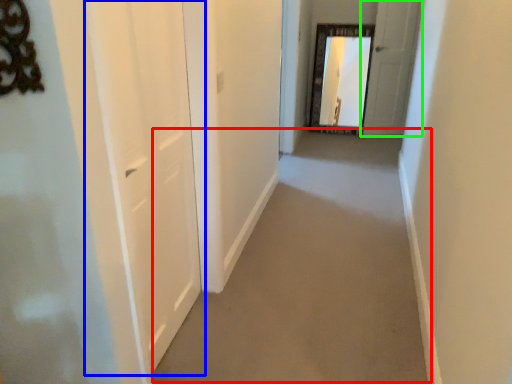
Question: Which is farther away from path (highlighted by a red box)? door (highlighted by a blue box) or door (highlighted by a green box)?

Choices:
 (A) door
 (B) door

Answer: (B)